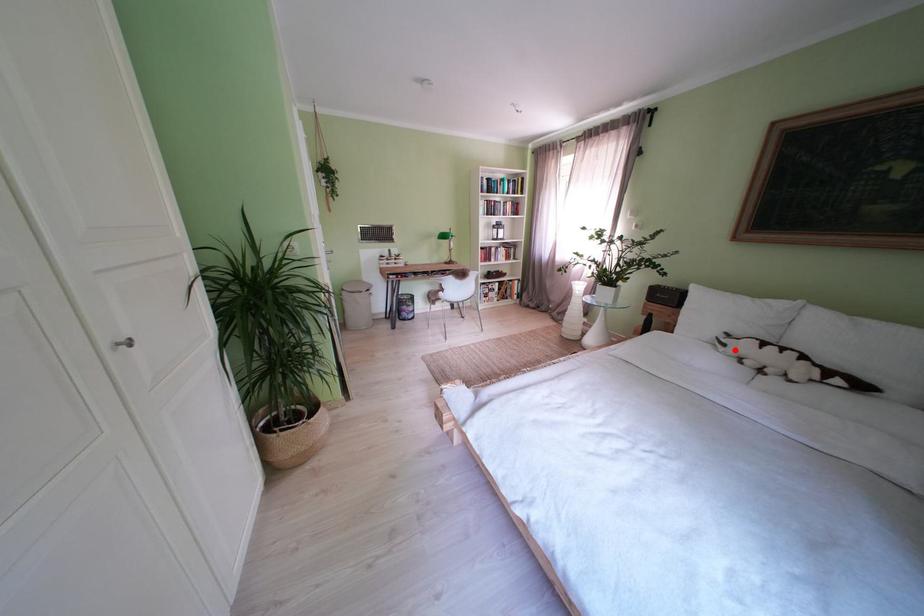
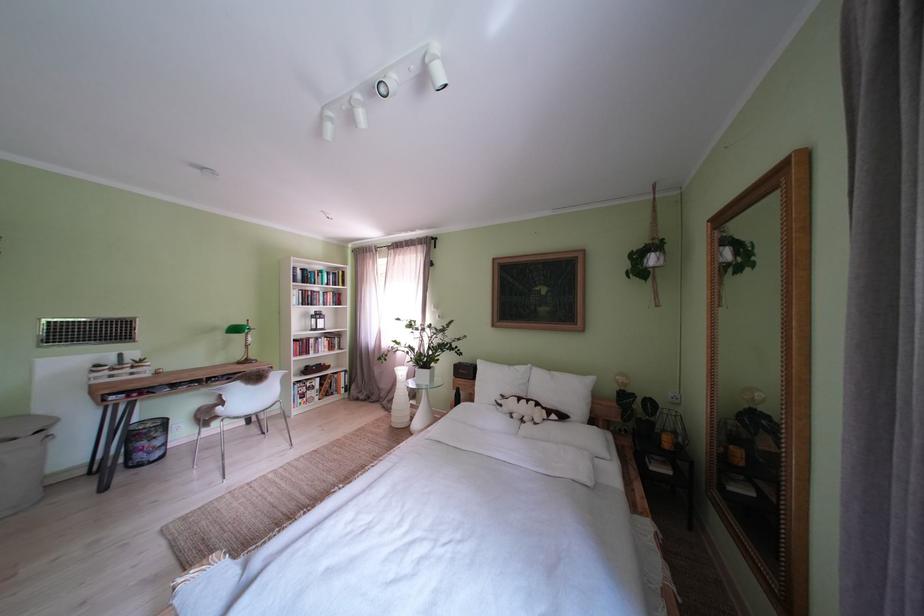
In the second image, find the point that corresponds to the highlighted location in the first image.

(512, 411)